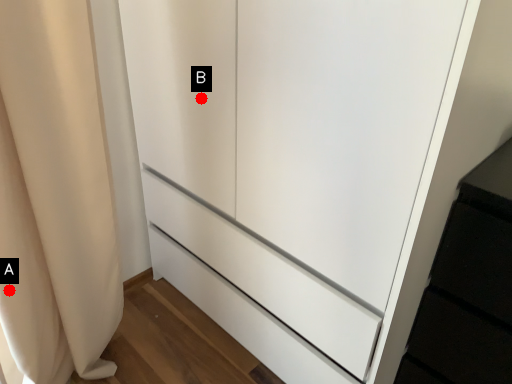
Question: Two points are circled on the image, labeled by A and B beside each circle. Which point is farther to the camera?

Choices:
 (A) A is further
 (B) B is further

Answer: (B)